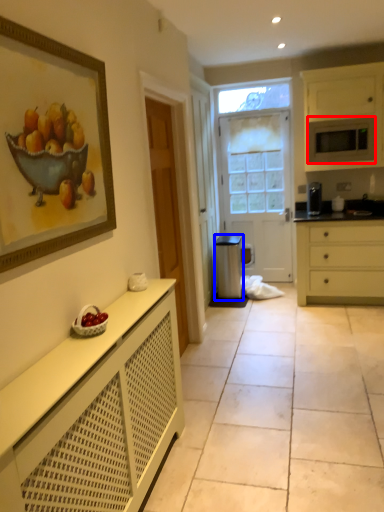
Question: Which point is further to the camera, microwave oven (highlighted by a red box) or appliance (highlighted by a blue box)?

Choices:
 (A) microwave oven
 (B) appliance

Answer: (B)